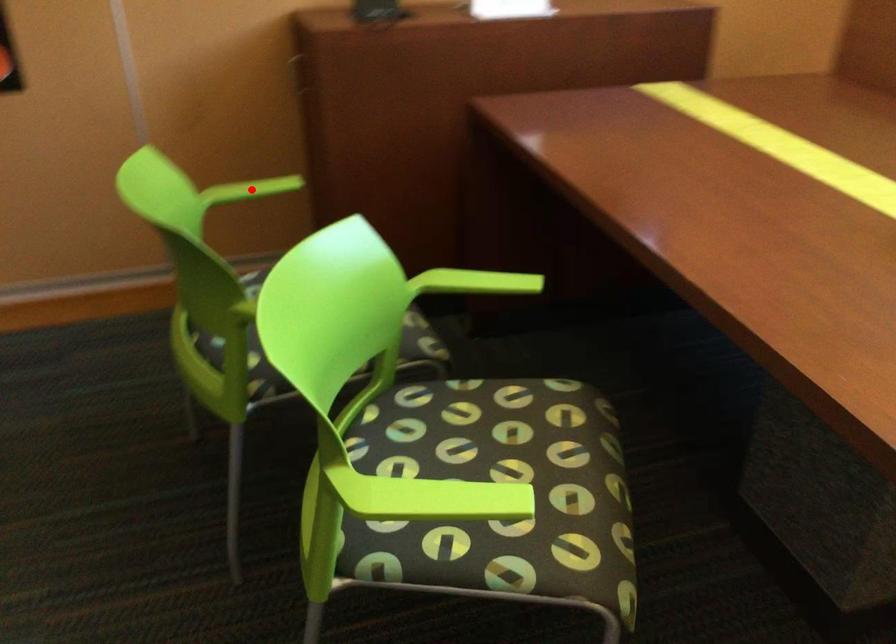
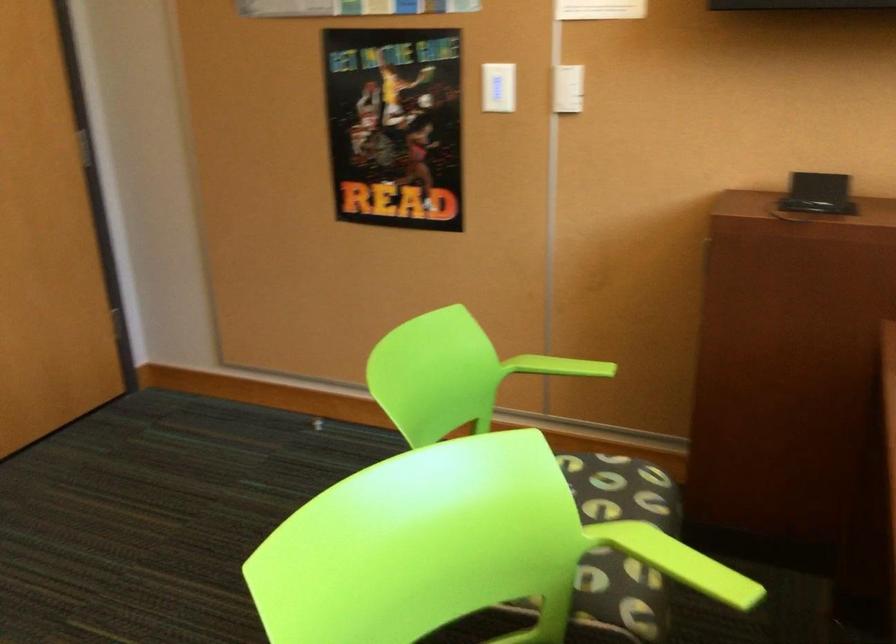
The point at the highlighted location is marked in the first image. Where is the corresponding point in the second image?

(558, 366)